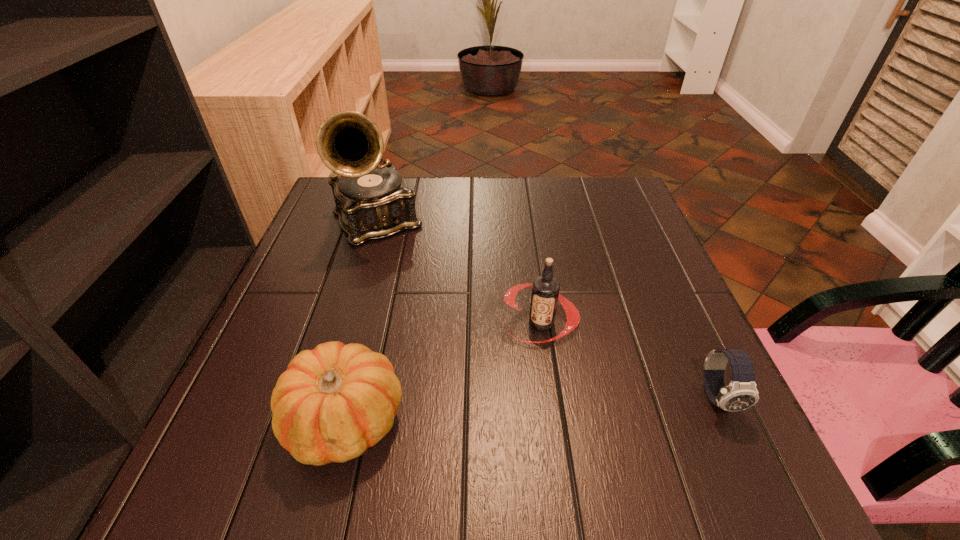
The height and width of the screenshot is (540, 960). I want to click on empty space between the gourd and the root beer, so click(x=443, y=372).

At what (x,y) coordinates should I click in order to perform the action: click on vacant area between the second object from right to left and the farthest object. Please return your answer as a coordinate pair (x, y). The width and height of the screenshot is (960, 540). Looking at the image, I should click on (458, 272).

This screenshot has height=540, width=960. I want to click on free space between the gourd and the tallest object, so click(361, 321).

The height and width of the screenshot is (540, 960). In order to click on vacant region between the watch and the second farthest object in this screenshot , I will do `click(629, 360)`.

Find the location of a particular element. free spot between the third object from left to right and the gourd is located at coordinates (443, 372).

Where is `free point between the watch and the gourd`? Image resolution: width=960 pixels, height=540 pixels. free point between the watch and the gourd is located at coordinates [532, 409].

Where is `the second closest object relative to the gourd`? The height and width of the screenshot is (540, 960). the second closest object relative to the gourd is located at coordinates (373, 202).

Identify which object is located as the second nearest to the watch. Please provide its 2D coordinates. Your answer should be formatted as a tuple, i.e. [(x, y)], where the tuple contains the x and y coordinates of a point satisfying the conditions above.

[(334, 402)]

Locate an element on the screen. This screenshot has height=540, width=960. free space that satisfies the following two spatial constraints: 1. on the front side of the gourd; 2. on the left side of the farthest object is located at coordinates (316, 421).